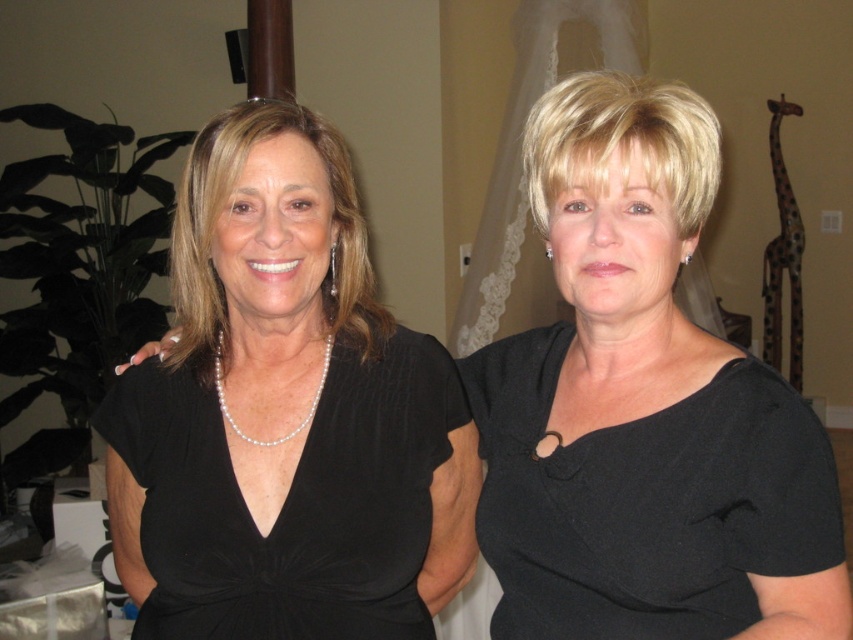
From the picture: You are a photographer setting up for a portrait. You want to focus on the black matte dress at center. Given that your camera has a depth of field that can sharply capture objects within 80 centimeters, will the dress be in focus?

The black matte dress at center is 85.27 centimeters from the camera. Since the depth of field can only sharply capture objects within 80 centimeters, the dress will be slightly out of focus.

You are organizing a charity event and need to choose between two dresses displayed in the center of the image. The black matte dress at center and the black satin dress at center. Which dress has a larger size?

The black matte dress at center is bigger than the black satin dress at center, so the black matte dress at center has a larger size.

From the picture: You are a photographer trying to capture a closeup shot of the woman on the left. You have two points marked in the image, point (537, 586) and point (405, 468). Which point should you focus on to get the closest possible focus on her?

Point (537, 586) is closer to the viewer than point (405, 468), so focusing on point (537, 586) will ensure the closest possible focus on the woman on the left.